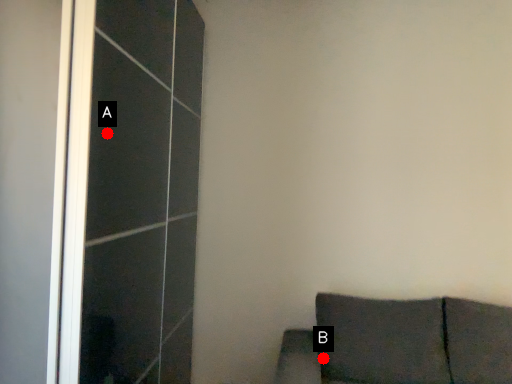
Question: Two points are circled on the image, labeled by A and B beside each circle. Which point appears closest to the camera in this image?

Choices:
 (A) A is closer
 (B) B is closer

Answer: (A)